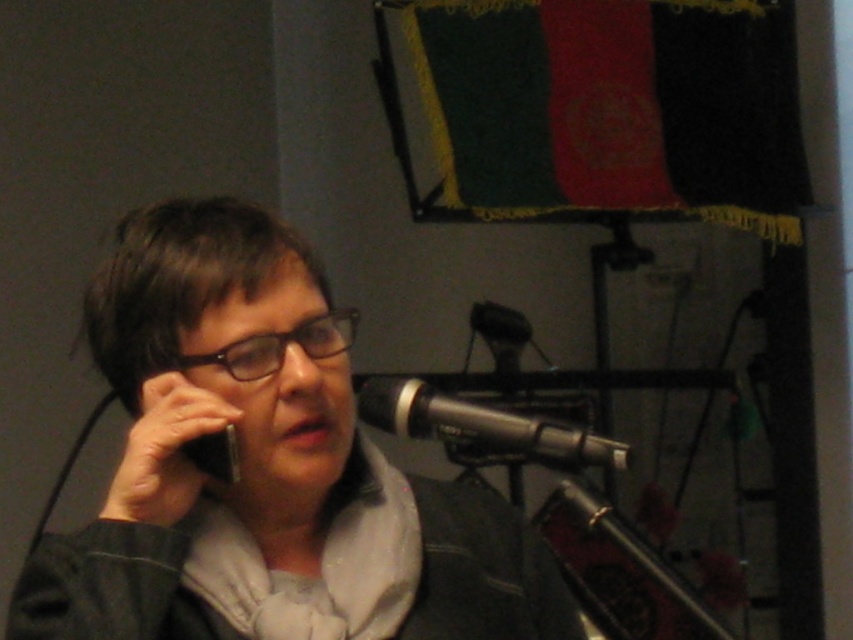
Does point (537, 448) come closer to viewer compared to point (345, 321)?

Yes, it is.

Can you confirm if black metallic microphone at center is taller than black plastic glasses at center?

Yes.

Locate an element on the screen. Image resolution: width=853 pixels, height=640 pixels. black metallic microphone at center is located at coordinates (485, 426).

Identify the location of black metallic microphone at center. This screenshot has height=640, width=853. (485, 426).

Who is shorter, black metallic microphone at center or black matte smartphone at upper left?

black matte smartphone at upper left

Who is positioned more to the right, black metallic microphone at center or black matte smartphone at upper left?

From the viewer's perspective, black metallic microphone at center appears more on the right side.

Does point (525, 429) lie in front of point (212, 465)?

Yes, it is.

You are a GUI agent. You are given a task and a screenshot of the screen. Output one action in this format:
    pyautogui.click(x=<x>, y=<y>)
    Task: Click on the black metallic microphone at center
    
    Given the screenshot: What is the action you would take?
    pyautogui.click(x=485, y=426)

What do you see at coordinates (263, 461) in the screenshot?
I see `matte black phone at center` at bounding box center [263, 461].

Can you confirm if matte black phone at center is bigger than black plastic glasses at center?

Correct, matte black phone at center is larger in size than black plastic glasses at center.

Does point (212, 416) come behind point (248, 356)?

No, (212, 416) is in front of (248, 356).

Identify the location of matte black phone at center. [263, 461].